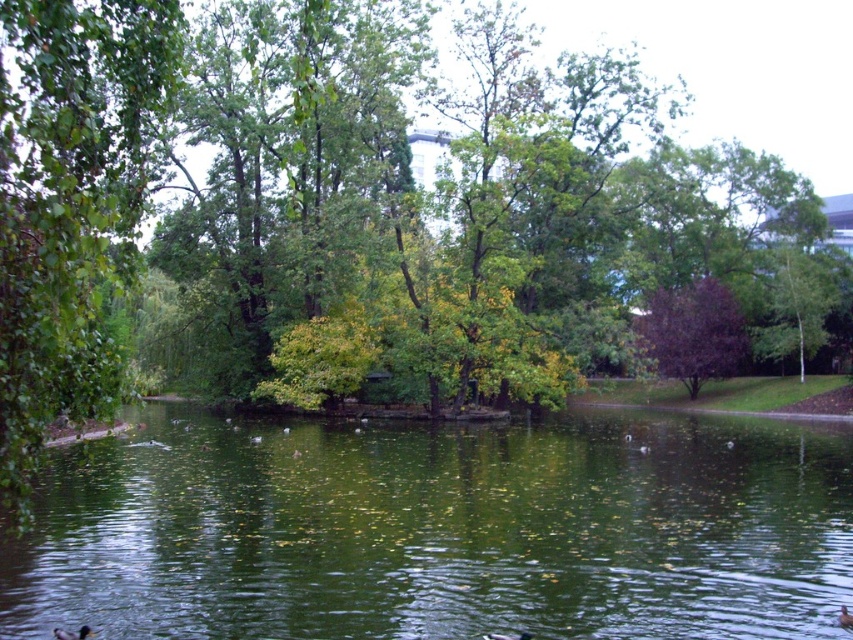
Can you confirm if purple glossy tree at center is thinner than brown fuzzy duck at center?

No.

This screenshot has width=853, height=640. Describe the element at coordinates (694, 332) in the screenshot. I see `purple glossy tree at center` at that location.

Is point (711, 294) positioned in front of point (526, 637)?

No, it is behind (526, 637).

Where is `purple glossy tree at center`? purple glossy tree at center is located at coordinates (694, 332).

Does green reflective water at center have a greater height compared to brown matte duck at lower center?

Correct, green reflective water at center is much taller as brown matte duck at lower center.

Looking at this image, is green reflective water at center in front of brown matte duck at lower center?

Yes, it is.

What do you see at coordinates (440, 531) in the screenshot?
I see `green reflective water at center` at bounding box center [440, 531].

This screenshot has width=853, height=640. I want to click on green reflective water at center, so click(440, 531).

Does brown fuzzy duck at lower left appear over brown fuzzy duck at center?

Yes, brown fuzzy duck at lower left is above brown fuzzy duck at center.

Which is in front, point (67, 637) or point (482, 634)?

Point (67, 637)

Identify the location of brown fuzzy duck at lower left. (73, 634).